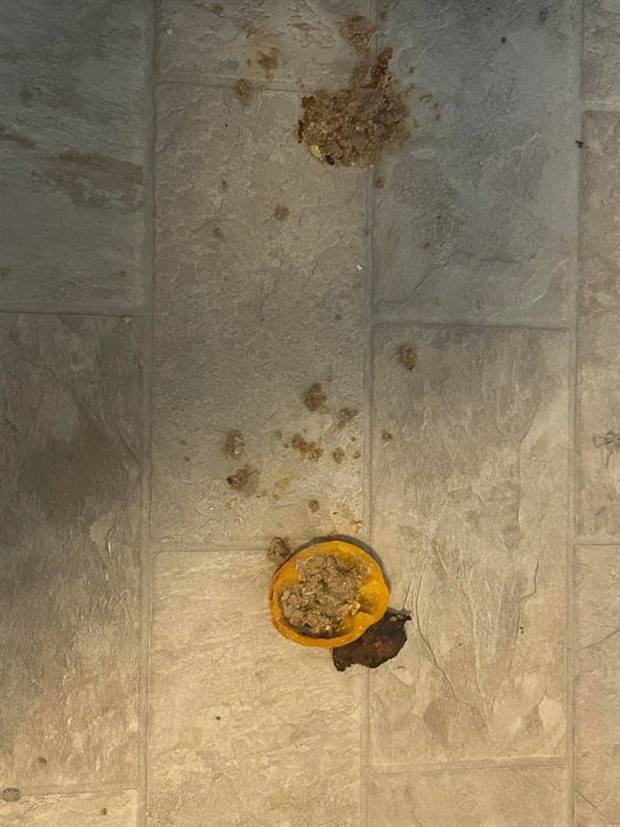
Where is `grout line`? The image size is (620, 827). grout line is located at coordinates (144, 337).